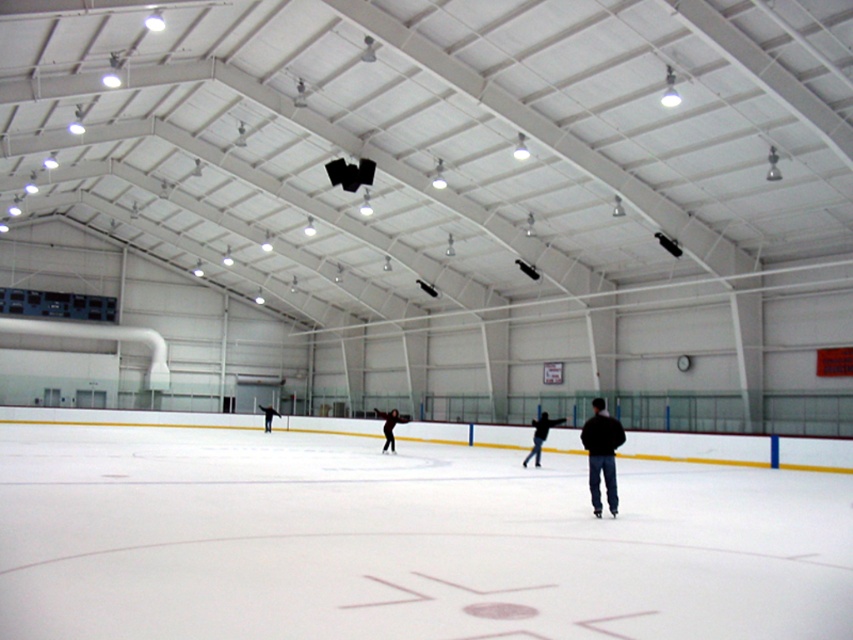
Question: Among these points, which one is farthest from the camera?

Choices:
 (A) (375, 412)
 (B) (590, 456)

Answer: (A)

Question: Which object appears farthest from the camera in this image?

Choices:
 (A) black matte skater at center
 (B) dark blue jacket at center

Answer: (A)

Question: Does white smooth ice at center have a greater width compared to black matte skater at center?

Choices:
 (A) yes
 (B) no

Answer: (A)

Question: Does dark blue jacket at center appear on the left side of dark brown leather jacket at center?

Choices:
 (A) yes
 (B) no

Answer: (B)

Question: Estimate the real-world distances between objects in this image. Which object is farther from the dark brown leather jacket at center?

Choices:
 (A) white smooth ice at center
 (B) dark blue jacket at center

Answer: (B)

Question: Is white smooth ice at center in front of black matte skater at center?

Choices:
 (A) yes
 (B) no

Answer: (A)